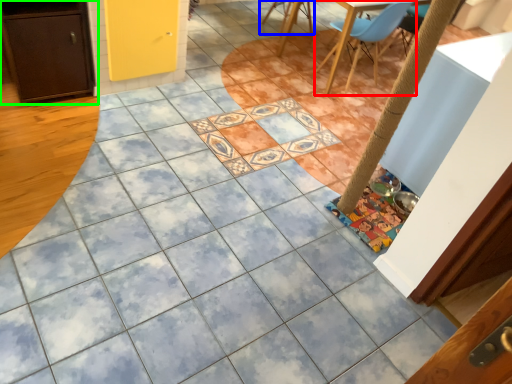
Question: Which object is positioned farthest from chair (highlighted by a red box)? Select from chair (highlighted by a blue box) and cabinetry (highlighted by a green box).

Choices:
 (A) chair
 (B) cabinetry

Answer: (B)